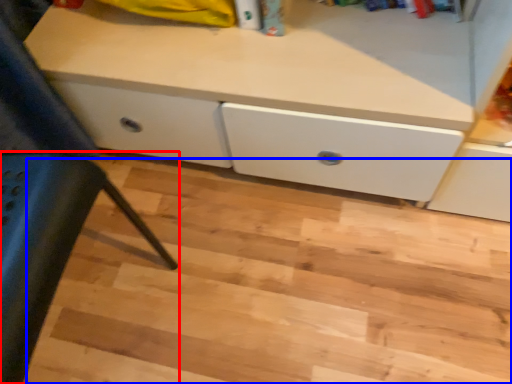
Question: Among these objects, which one is farthest to the camera, furniture (highlighted by a red box) or stair (highlighted by a blue box)?

Choices:
 (A) furniture
 (B) stair

Answer: (B)